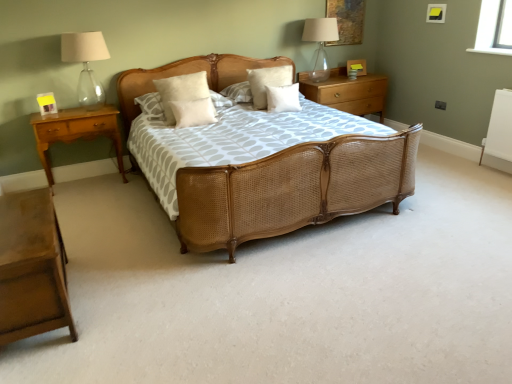
Question: From the image's perspective, is woven wood bed at center above white soft pillow at center, the fourth pillow positioned from the right?

Choices:
 (A) yes
 (B) no

Answer: (B)

Question: Does woven wood bed at center have a lesser width compared to white soft pillow at center, placed as the 1th pillow when sorted from left to right?

Choices:
 (A) no
 (B) yes

Answer: (A)

Question: Could you tell me if woven wood bed at center is turned towards white soft pillow at center, the fourth pillow positioned from the right?

Choices:
 (A) no
 (B) yes

Answer: (A)

Question: Does woven wood bed at center have a greater width compared to white soft pillow at center, the fourth pillow positioned from the right?

Choices:
 (A) yes
 (B) no

Answer: (A)

Question: From a real-world perspective, is woven wood bed at center located beneath white soft pillow at center, the fourth pillow positioned from the right?

Choices:
 (A) yes
 (B) no

Answer: (A)

Question: From a real-world perspective, is woven wood bed at center located higher than white soft pillow at center, the fourth pillow positioned from the right?

Choices:
 (A) no
 (B) yes

Answer: (A)

Question: Is white soft pillow at center, the fourth pillow positioned from the right, inside wooden nightstand at right, the third nightstand when ordered from front to back?

Choices:
 (A) no
 (B) yes

Answer: (A)

Question: Is wooden nightstand at right, arranged as the first nightstand when viewed from the top, placed right next to white soft pillow at center, placed as the 1th pillow when sorted from left to right?

Choices:
 (A) no
 (B) yes

Answer: (A)

Question: Does wooden nightstand at right, arranged as the first nightstand when viewed from the top, have a larger size compared to white soft pillow at center, the fourth pillow positioned from the right?

Choices:
 (A) no
 (B) yes

Answer: (B)

Question: Is wooden nightstand at right, the 1th nightstand in the back-to-front sequence, at the right side of white soft pillow at center, placed as the 1th pillow when sorted from left to right?

Choices:
 (A) yes
 (B) no

Answer: (A)

Question: Is wooden nightstand at right, which is counted as the third nightstand, starting from the bottom, wider than white soft pillow at center, placed as the 1th pillow when sorted from left to right?

Choices:
 (A) no
 (B) yes

Answer: (B)

Question: Is wooden nightstand at right, marked as the third nightstand in a left-to-right arrangement, outside of white soft pillow at center, the fourth pillow positioned from the right?

Choices:
 (A) yes
 (B) no

Answer: (A)

Question: Is white soft pillow at center, placed as the 1th pillow when sorted from left to right, not close to light brown wood nightstand at left, placed as the second nightstand when sorted from top to bottom?

Choices:
 (A) yes
 (B) no

Answer: (B)